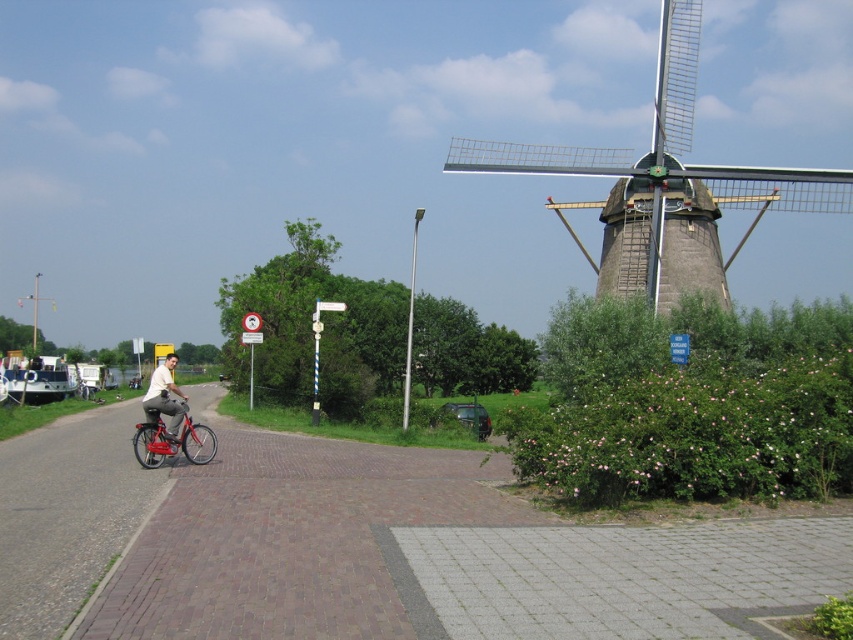
You are standing at the point closer to the camera in this scene. There are two points marked in the image labeled as point (506, 154) and point (154, 412). Which point are you standing at?

You are standing at point (506, 154) because it is closer to the camera than point (154, 412).

You are a photographer standing at the center of the paved path. You want to capture a photo that includes both the gray stone windmill at upper right and the metallic red bicycle at left. Will the windmill appear above or below the bicycle in the photo?

The gray stone windmill at upper right is positioned over metallic red bicycle at left, so in the photo, the windmill will appear above the bicycle.

You are a photographer positioned at the scene. You want to take a photo of the matte white shirt at center without the gray stone windmill at upper right blocking it. What should you do?

Move to the left side of the gray stone windmill at upper right so that the matte white shirt at center is visible without obstruction from the windmill.